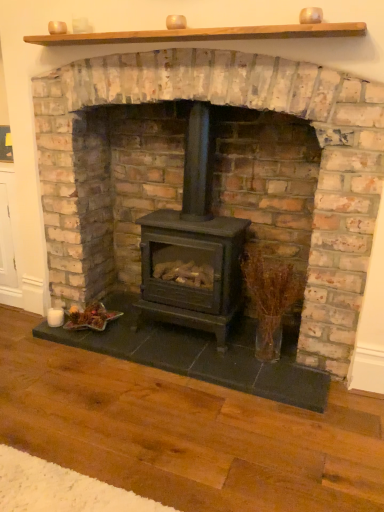
Question: Would you say black matte wood stove at center is to the left or to the right of black matte wood burning stove at center in the picture?

Choices:
 (A) left
 (B) right

Answer: (B)

Question: In terms of width, does black matte wood stove at center look wider or thinner when compared to black matte wood burning stove at center?

Choices:
 (A) wide
 (B) thin

Answer: (A)

Question: Estimate the real-world distances between objects in this image. Which object is farther from the black matte wood stove at center?

Choices:
 (A) translucent glass vase at right
 (B) black matte wood burning stove at center

Answer: (A)

Question: Considering the real-world distances, which object is farthest from the translucent glass vase at right?

Choices:
 (A) black matte wood burning stove at center
 (B) black matte wood stove at center

Answer: (B)